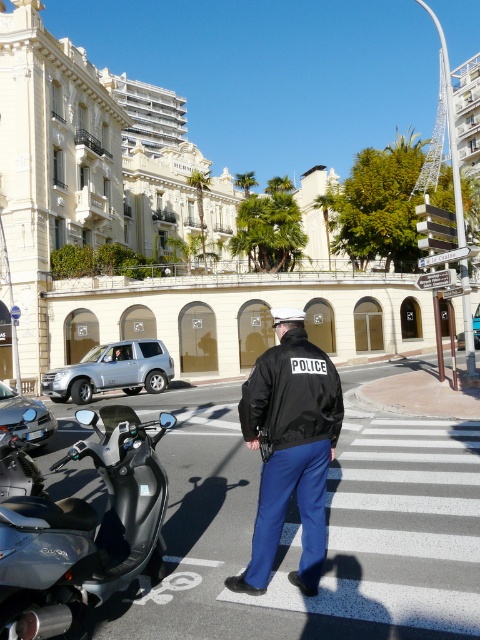
You are a pedestrian trying to cross the street safely. You see a black matte scooter at lower left and a black leather jacket at center. Which object is closer to you as you approach the crosswalk?

The black matte scooter at lower left is closer to you because it is in front of the black leather jacket at center, meaning it is positioned nearer to your viewpoint as you approach the crosswalk.

You are a pedestrian trying to cross the street safely. You see a black matte scooter at lower left and a black leather jacket at center. Which object is closer to you as you stand at the pedestrian crossing?

The black matte scooter at lower left is closer to you because it is positioned over the black leather jacket at center, indicating it is in front.

You are a delivery person who needs to load a large package onto the black matte scooter at lower left. The package is taller than the black leather jacket at center. Will the package fit on the scooter without exceeding its height?

The black matte scooter at lower left has a greater height compared to the black leather jacket at center. Since the package is taller than the jacket, it may still exceed the scooter height. However, the scooter is taller than the jacket, so if the package is only slightly taller than the jacket, it might fit. The exact fit depends on the package dimensions relative to the scooter.